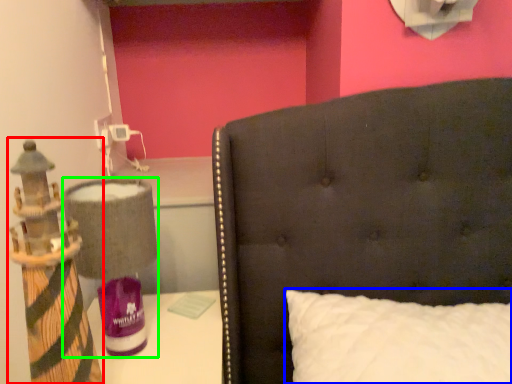
Question: Considering the real-world distances, which object is farthest from toy (highlighted by a red box)? pillow (highlighted by a blue box) or table lamp (highlighted by a green box)?

Choices:
 (A) pillow
 (B) table lamp

Answer: (A)